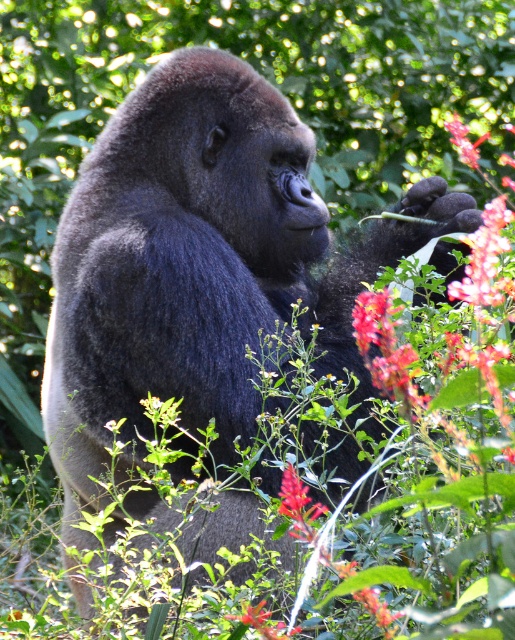
Between vivid crimson petals at upper right and vibrant pink petals at center, which one appears on the left side from the viewer's perspective?

vivid crimson petals at upper right is more to the left.

Which is below, vivid crimson petals at upper right or vibrant pink petals at center?

Positioned lower is vivid crimson petals at upper right.

Is point (493, 269) closer to viewer compared to point (456, 141)?

Yes, it is in front of point (456, 141).

This screenshot has height=640, width=515. What are the coordinates of `vivid crimson petals at upper right` in the screenshot? It's located at (484, 257).

Who is shorter, vivid crimson petals at upper right or vibrant red petals at center?

vibrant red petals at center is shorter.

Between vivid crimson petals at upper right and vibrant red petals at center, which one appears on the left side from the viewer's perspective?

vibrant red petals at center is more to the left.

Who is more distant from viewer, (474, 264) or (251, 625)?

The point (474, 264) is more distant.

Locate an element on the screen. vivid crimson petals at upper right is located at coordinates (484, 257).

This screenshot has width=515, height=640. I want to click on vibrant red petals at center, so click(259, 621).

Between vibrant red petals at center and vibrant pink petals at center, which one is positioned lower?

vibrant red petals at center

From the picture: Who is more forward, (263, 637) or (464, 154)?

Point (263, 637) is more forward.

This screenshot has height=640, width=515. I want to click on vibrant red petals at center, so click(259, 621).